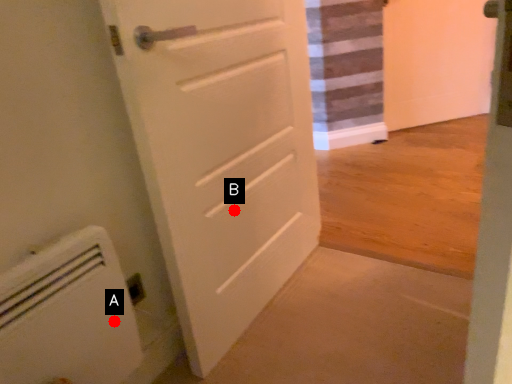
Question: Two points are circled on the image, labeled by A and B beside each circle. Which of the following is the closest to the observer?

Choices:
 (A) A is closer
 (B) B is closer

Answer: (A)